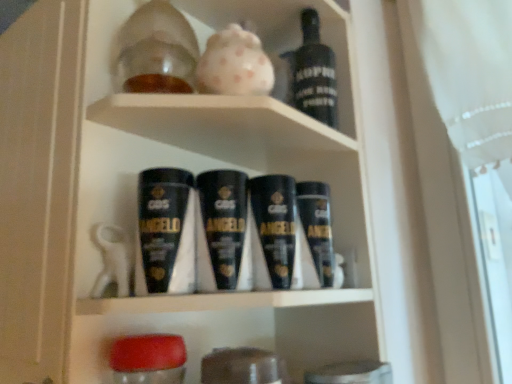
Question: Is point (344, 89) positioned closer to the camera than point (305, 97)?

Choices:
 (A) closer
 (B) farther

Answer: (B)

Question: From the image's perspective, relative to black matte bottle at upper center, is translucent glass jar at upper center above or below?

Choices:
 (A) below
 (B) above

Answer: (B)

Question: Which object is positioned farthest from the translucent glass jar at upper center?

Choices:
 (A) black matte shaving cream at center
 (B) black matte bottle at upper center

Answer: (A)

Question: Which of these objects is positioned closest to the black matte bottle at upper center?

Choices:
 (A) black matte shaving cream at center
 (B) translucent glass jar at upper center

Answer: (B)